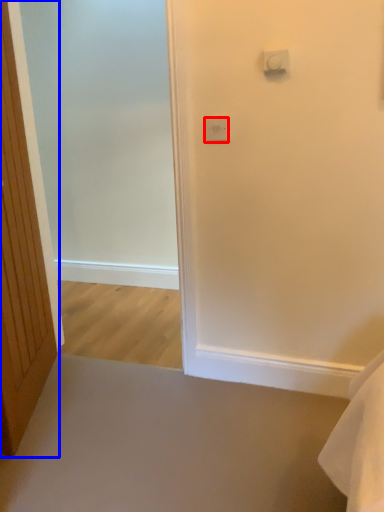
Question: Which object is further to the camera taking this photo, light switch (highlighted by a red box) or door (highlighted by a blue box)?

Choices:
 (A) light switch
 (B) door

Answer: (A)